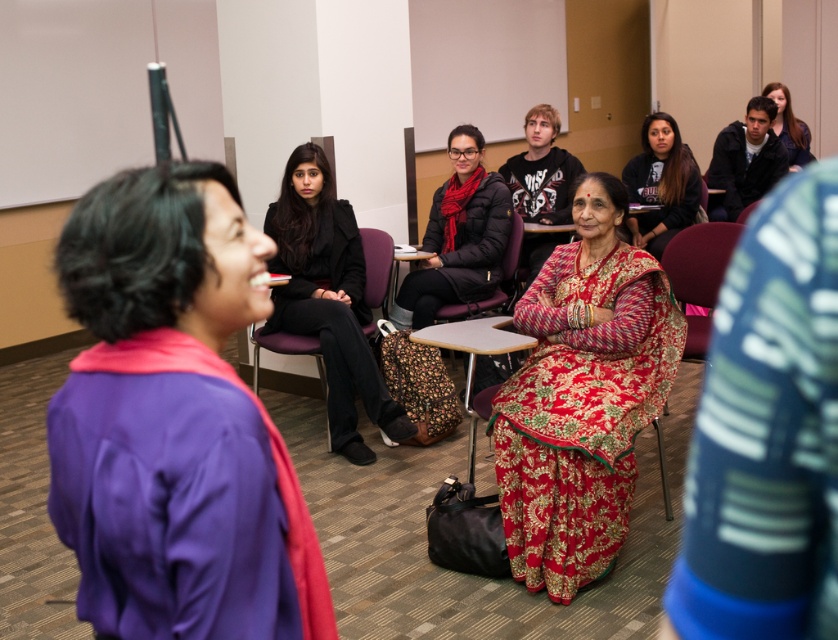
You are standing in the classroom and want to move from the point at coordinates point (588, 253) to the point at coordinates point (681, 355). Is the destination point closer to the front of the room or the back?

The point at coordinates point (681, 355) is closer to the back of the room because point (588, 253) is in front of it, meaning the destination is behind the starting point.